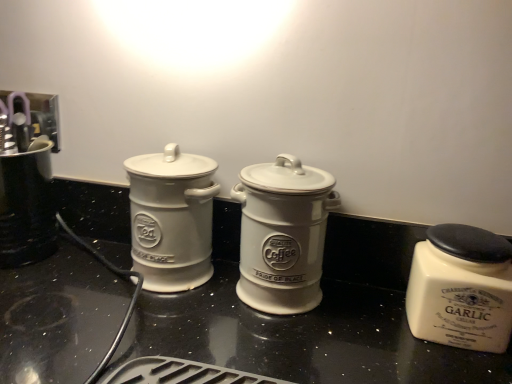
Question: Would you consider white ceramic coffee canister at center, acting as the 2th kitchen appliance starting from the right, to be distant from white ceramic jar at left, acting as the third kitchen appliance starting from the right?

Choices:
 (A) no
 (B) yes

Answer: (A)

Question: Is white ceramic coffee canister at center, arranged as the 2th kitchen appliance when viewed from the left, positioned in front of white ceramic jar at left, positioned as the 1th kitchen appliance in left-to-right order?

Choices:
 (A) yes
 (B) no

Answer: (A)

Question: Is white ceramic coffee canister at center, arranged as the 2th kitchen appliance when viewed from the left, wider than white ceramic jar at left, positioned as the 1th kitchen appliance in left-to-right order?

Choices:
 (A) yes
 (B) no

Answer: (A)

Question: Would you say white ceramic jar at left, positioned as the 1th kitchen appliance in left-to-right order, is part of white ceramic coffee canister at center, arranged as the 2th kitchen appliance when viewed from the left,'s contents?

Choices:
 (A) yes
 (B) no

Answer: (B)

Question: Considering the relative positions of white ceramic coffee canister at center, arranged as the 2th kitchen appliance when viewed from the left, and white ceramic jar at left, positioned as the 1th kitchen appliance in left-to-right order, in the image provided, is white ceramic coffee canister at center, arranged as the 2th kitchen appliance when viewed from the left, to the right of white ceramic jar at left, positioned as the 1th kitchen appliance in left-to-right order, from the viewer's perspective?

Choices:
 (A) yes
 (B) no

Answer: (A)

Question: From a real-world perspective, is brushed metal coffee maker at left above or below white ceramic jar at left, acting as the third kitchen appliance starting from the right?

Choices:
 (A) below
 (B) above

Answer: (A)

Question: In terms of width, does brushed metal coffee maker at left look wider or thinner when compared to white ceramic jar at left, acting as the third kitchen appliance starting from the right?

Choices:
 (A) wide
 (B) thin

Answer: (A)

Question: Is point tap(17, 253) closer or farther from the camera than point tap(182, 235)?

Choices:
 (A) farther
 (B) closer

Answer: (A)

Question: Considering the relative positions of brushed metal coffee maker at left and white ceramic jar at left, acting as the third kitchen appliance starting from the right, in the image provided, is brushed metal coffee maker at left to the left or to the right of white ceramic jar at left, acting as the third kitchen appliance starting from the right,?

Choices:
 (A) right
 (B) left

Answer: (B)

Question: From a real-world perspective, is brushed metal coffee maker at left positioned above or below white ceramic garlic jar at right, the third kitchen appliance from the left?

Choices:
 (A) above
 (B) below

Answer: (A)

Question: Looking at their shapes, would you say brushed metal coffee maker at left is wider or thinner than white ceramic garlic jar at right, the third kitchen appliance from the left?

Choices:
 (A) wide
 (B) thin

Answer: (A)

Question: From the image's perspective, relative to white ceramic garlic jar at right, the third kitchen appliance from the left, is brushed metal coffee maker at left above or below?

Choices:
 (A) above
 (B) below

Answer: (A)

Question: Is brushed metal coffee maker at left taller or shorter than white ceramic garlic jar at right, the third kitchen appliance from the left?

Choices:
 (A) tall
 (B) short

Answer: (A)

Question: Is white ceramic garlic jar at right, which is the 1th kitchen appliance in right-to-left order, to the left or to the right of white ceramic jar at left, acting as the third kitchen appliance starting from the right, in the image?

Choices:
 (A) left
 (B) right

Answer: (B)

Question: Considering their positions, is white ceramic garlic jar at right, the third kitchen appliance from the left, located in front of or behind white ceramic jar at left, acting as the third kitchen appliance starting from the right?

Choices:
 (A) front
 (B) behind

Answer: (A)